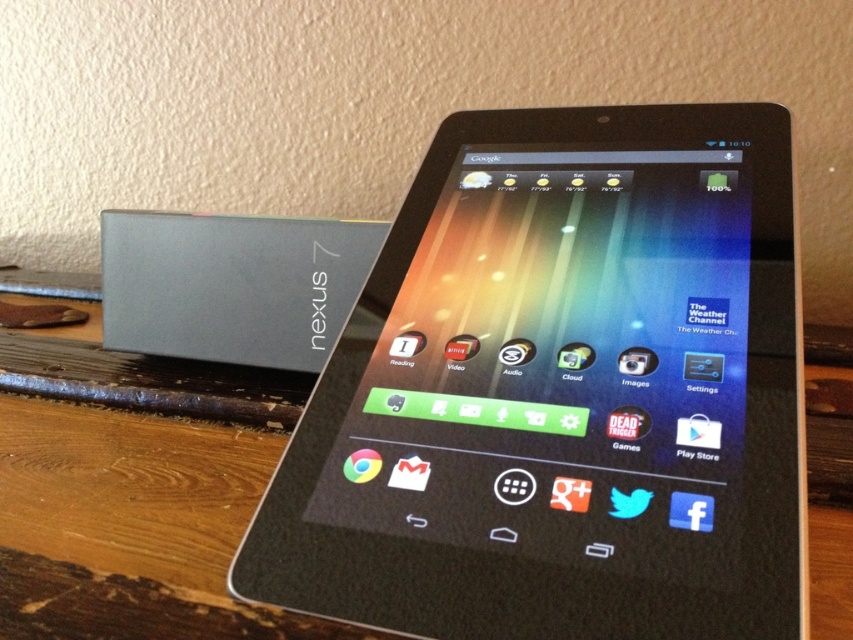
Is black glossy tablet at center to the left of slate gray plastic nexus 7 at left from the viewer's perspective?

In fact, black glossy tablet at center is to the right of slate gray plastic nexus 7 at left.

Who is more forward, [410,424] or [253,348]?

Point [410,424]

Locate an element on the screen. Image resolution: width=853 pixels, height=640 pixels. black glossy tablet at center is located at coordinates (561, 392).